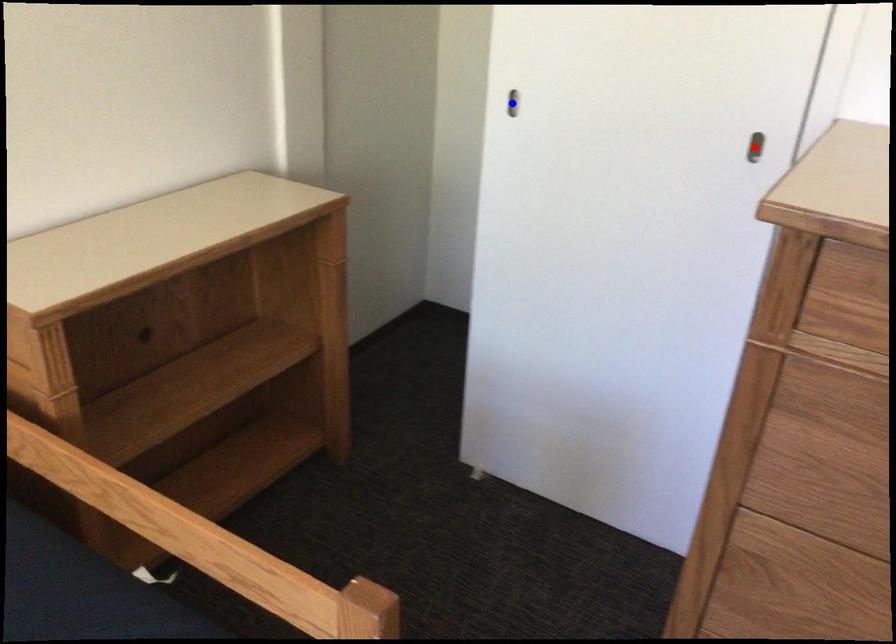
Question: In the image, two points are highlighted. Which point is nearer to the camera? Reply with the corresponding letter.

Choices:
 (A) blue point
 (B) red point

Answer: (B)